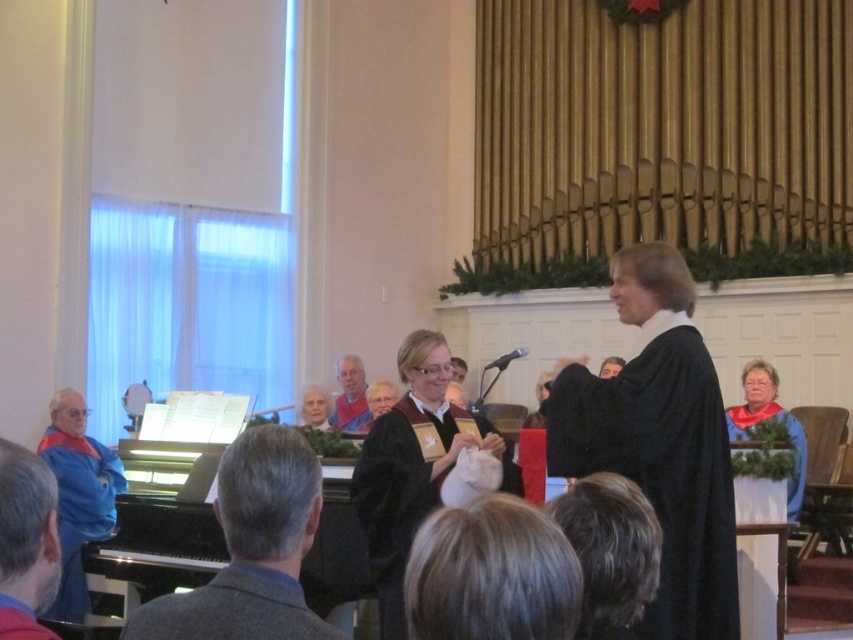
How distant is blue fabric at lower left from matte red robe at center?

blue fabric at lower left and matte red robe at center are 7.43 meters apart.

Between blue fabric at lower left and matte red robe at center, which one appears on the left side from the viewer's perspective?

From the viewer's perspective, matte red robe at center appears more on the left side.

Is point (0, 545) farther from camera compared to point (350, 429)?

No, it is not.

I want to click on blue fabric at lower left, so click(x=26, y=541).

Does matte black robe at center have a greater width compared to blue fleece robe at left?

No, matte black robe at center is not wider than blue fleece robe at left.

Between point (397, 586) and point (111, 465), which one is positioned behind?

Point (111, 465)

Locate an element on the screen. The height and width of the screenshot is (640, 853). matte black robe at center is located at coordinates (399, 496).

Is point (401, 566) more distant than point (791, 476)?

That is False.

Measure the distance from matte black robe at center to blue velvet robe at lower right.

matte black robe at center is 9.83 feet from blue velvet robe at lower right.

Describe the element at coordinates (399, 496) in the screenshot. I see `matte black robe at center` at that location.

Locate an element on the screen. The image size is (853, 640). matte black robe at center is located at coordinates (x=399, y=496).